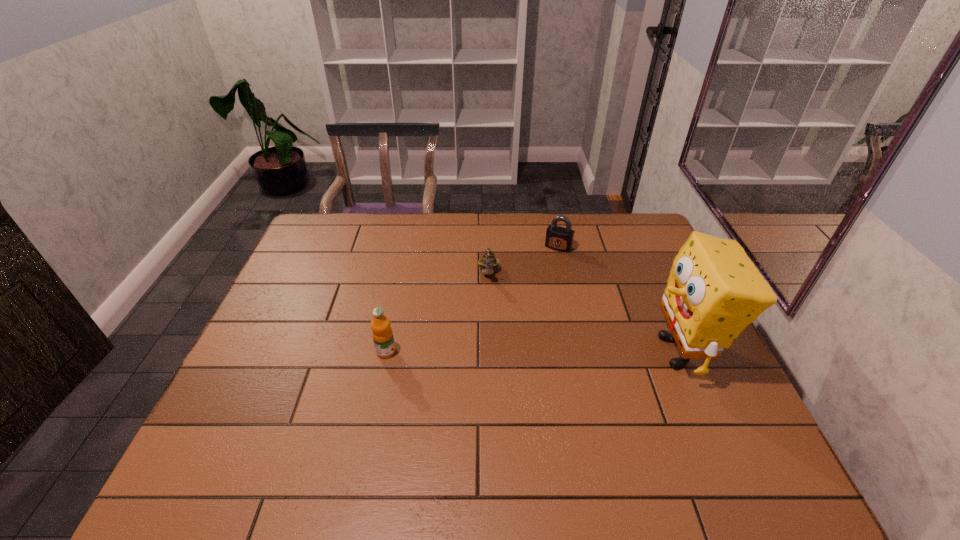
At what (x,y) coordinates should I click in order to perform the action: click on free space between the orange juice and the third nearest object. Please return your answer as a coordinate pair (x, y). Looking at the image, I should click on (438, 313).

Find the location of a particular element. This screenshot has width=960, height=540. blank region between the second farthest object and the padlock is located at coordinates (524, 260).

You are a GUI agent. You are given a task and a screenshot of the screen. Output one action in this format:
    pyautogui.click(x=<x>, y=<y>)
    Task: Click on the vacant region between the tallest object and the third object from left to right
    
    Given the screenshot: What is the action you would take?
    pyautogui.click(x=619, y=299)

Where is `vacant space in between the second farthest object and the orange juice`? The image size is (960, 540). vacant space in between the second farthest object and the orange juice is located at coordinates (438, 313).

Image resolution: width=960 pixels, height=540 pixels. I want to click on vacant point located between the tallest object and the snail, so click(585, 313).

Locate an element on the screen. object that ranks as the third closest to the leftmost object is located at coordinates (714, 290).

In order to click on object that is the third closest to the snail in this screenshot , I will do `click(714, 290)`.

Locate an element on the screen. vacant area in the image that satisfies the following two spatial constraints: 1. on the back side of the farthest object; 2. on the left side of the snail is located at coordinates (489, 247).

You are a GUI agent. You are given a task and a screenshot of the screen. Output one action in this format:
    pyautogui.click(x=<x>, y=<y>)
    Task: Click on the free location that satisfies the following two spatial constraints: 1. on the front side of the second object from right to left; 2. on the face of the rightmost object
    This screenshot has width=960, height=540.
    Given the screenshot: What is the action you would take?
    click(582, 352)

The width and height of the screenshot is (960, 540). Identify the location of vacant space that satisfies the following two spatial constraints: 1. on the front side of the padlock; 2. on the face of the sponge. (582, 352).